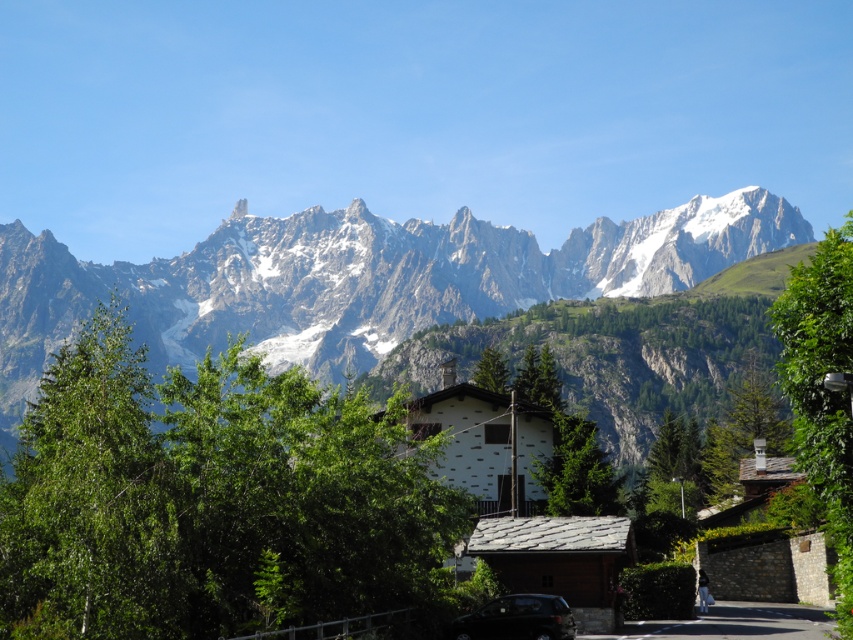
You are a hiker who just arrived at this mountain village. You see a gray asphalt road at lower center and a metallic dark gray car at center. Which object is positioned to the right of the other?

The gray asphalt road at lower center is to the right of the metallic dark gray car at center.